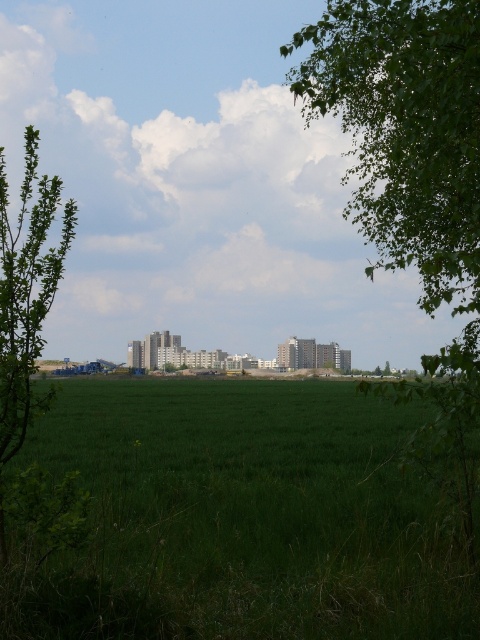
Measure the distance between point (129, 620) and camera.

Point (129, 620) and camera are 5.29 meters apart from each other.

You are a GUI agent. You are given a task and a screenshot of the screen. Output one action in this format:
    pyautogui.click(x=<x>, y=<y>)
    Task: Click on the green grassy field at lower center
    This screenshot has height=640, width=480.
    Given the screenshot: What is the action you would take?
    pyautogui.click(x=240, y=516)

Can you confirm if green grassy field at lower center is thinner than green leafy tree at left?

No.

Is green grassy field at lower center further to camera compared to green leafy tree at left?

No, it is not.

Where is `green grassy field at lower center`? Image resolution: width=480 pixels, height=640 pixels. green grassy field at lower center is located at coordinates [x=240, y=516].

Is point (349, 67) farther from viewer compared to point (21, 272)?

Yes.

Can you confirm if green leafy tree at upper right is bigger than green leafy tree at left?

Correct, green leafy tree at upper right is larger in size than green leafy tree at left.

Find the location of `green leafy tree at upper right`. green leafy tree at upper right is located at coordinates (405, 131).